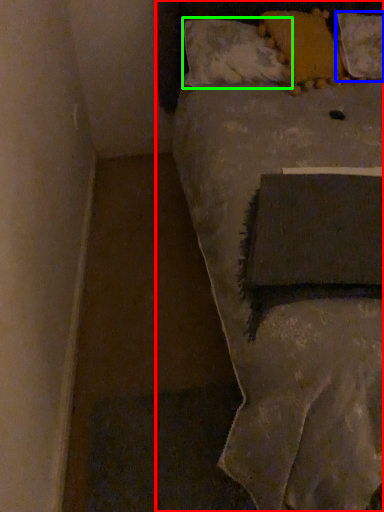
Question: Which object is the farthest from bed (highlighted by a red box)? Choose among these: pillow (highlighted by a blue box) or pillow (highlighted by a green box).

Choices:
 (A) pillow
 (B) pillow

Answer: (A)